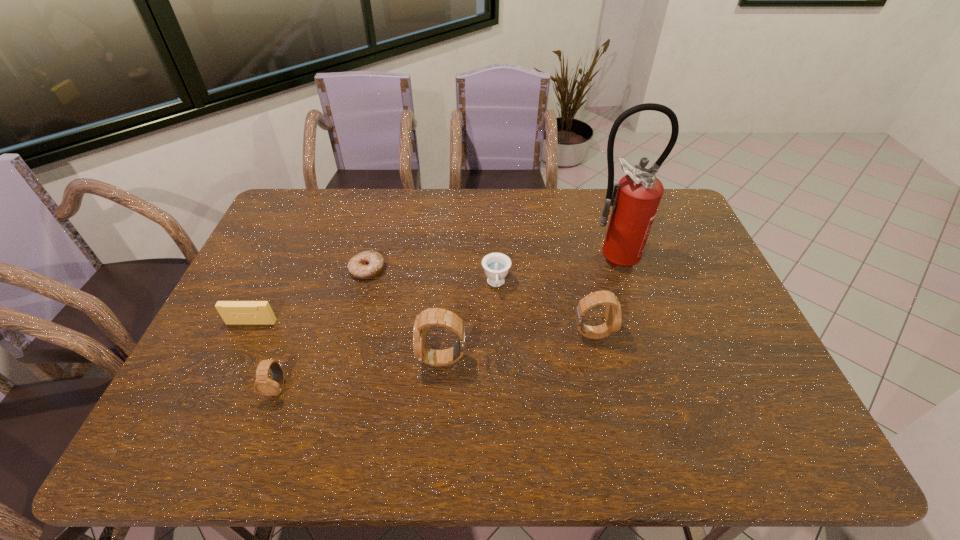
Where is `vacant point that satisfies the following two spatial constraints: 1. at the nozzle of the fire extinguisher; 2. on the face of the second watch from right to left`? vacant point that satisfies the following two spatial constraints: 1. at the nozzle of the fire extinguisher; 2. on the face of the second watch from right to left is located at coordinates (641, 359).

You are a GUI agent. You are given a task and a screenshot of the screen. Output one action in this format:
    pyautogui.click(x=<x>, y=<y>)
    Task: Click on the vacant region that satisfies the following two spatial constraints: 1. at the nozzle of the tallest object; 2. on the face of the fourth object from left to right
    
    Given the screenshot: What is the action you would take?
    pyautogui.click(x=641, y=359)

Image resolution: width=960 pixels, height=540 pixels. I want to click on blank space that satisfies the following two spatial constraints: 1. on the face of the fifth shortest object; 2. on the face of the fourth tallest object, so click(604, 388).